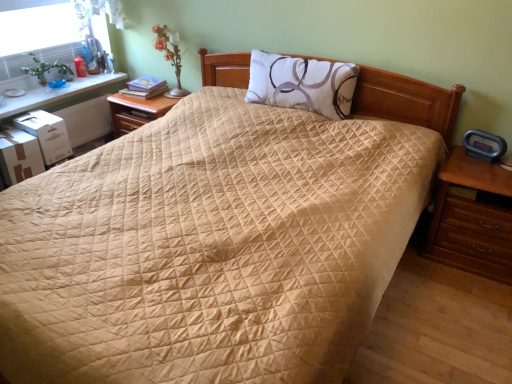
I want to click on vacant space underneath matte white glass table lamp at upper left (from a real-world perspective), so click(x=179, y=91).